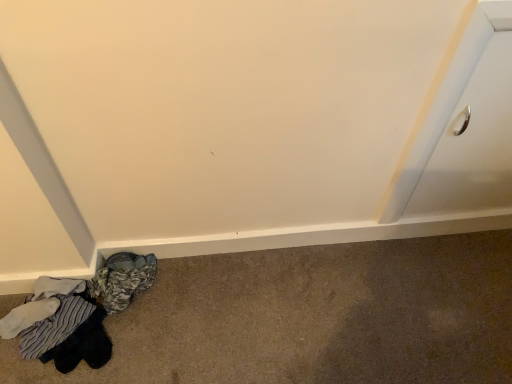
Question: From the image's perspective, is striped cotton socks at lower left positioned above or below white glossy drawer at upper right?

Choices:
 (A) below
 (B) above

Answer: (A)

Question: From a real-world perspective, is striped cotton socks at lower left positioned above or below white glossy drawer at upper right?

Choices:
 (A) above
 (B) below

Answer: (B)

Question: Is striped cotton socks at lower left inside or outside of white glossy drawer at upper right?

Choices:
 (A) outside
 (B) inside

Answer: (A)

Question: Is white glossy drawer at upper right spatially inside striped cotton socks at lower left, or outside of it?

Choices:
 (A) inside
 (B) outside

Answer: (B)

Question: Looking at the image, does white glossy drawer at upper right seem bigger or smaller compared to striped cotton socks at lower left?

Choices:
 (A) small
 (B) big

Answer: (A)

Question: Relative to striped cotton socks at lower left, is white glossy drawer at upper right in front or behind?

Choices:
 (A) behind
 (B) front

Answer: (B)

Question: Is white glossy drawer at upper right wider or thinner than striped cotton socks at lower left?

Choices:
 (A) wide
 (B) thin

Answer: (B)